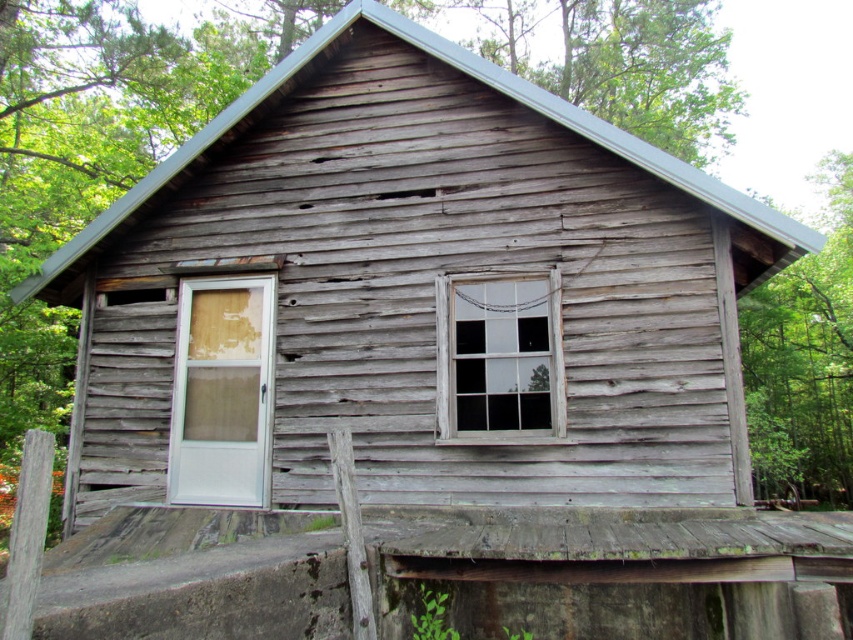
Question: Which object is positioned closest to the green leafy tree at upper right?

Choices:
 (A) clear glass window at center
 (B) white plastic door at left

Answer: (A)

Question: Which point is closer to the camera taking this photo?

Choices:
 (A) (779, 324)
 (B) (247, 365)

Answer: (B)

Question: Which object is farther from the camera taking this photo?

Choices:
 (A) green leafy tree at upper right
 (B) clear glass window at center
 (C) white plastic door at left

Answer: (C)

Question: In this image, where is white plastic door at left located relative to clear glass window at center?

Choices:
 (A) right
 (B) left

Answer: (B)

Question: Is green leafy tree at upper right further to the viewer compared to white plastic door at left?

Choices:
 (A) no
 (B) yes

Answer: (A)

Question: Can you confirm if green leafy tree at upper right is positioned to the left of clear glass window at center?

Choices:
 (A) yes
 (B) no

Answer: (B)